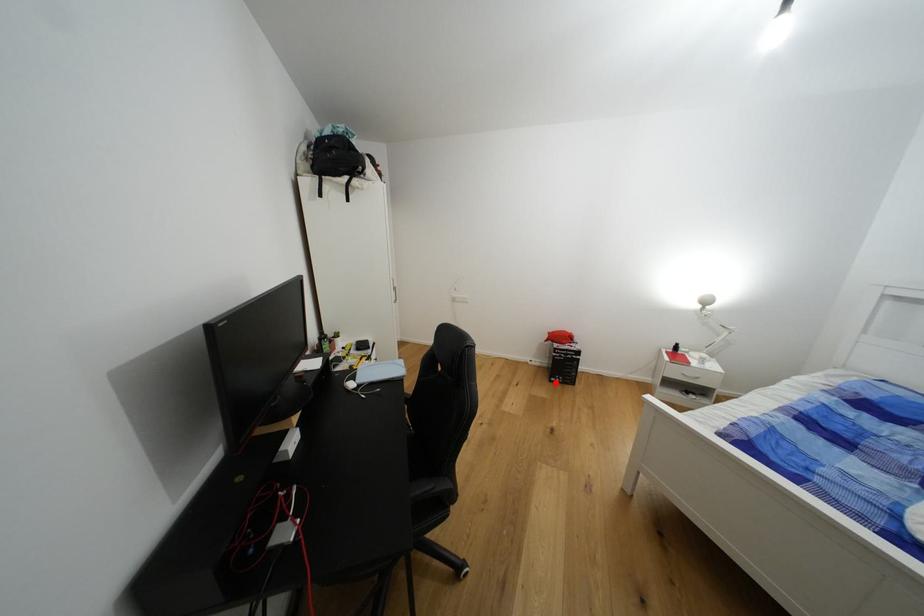
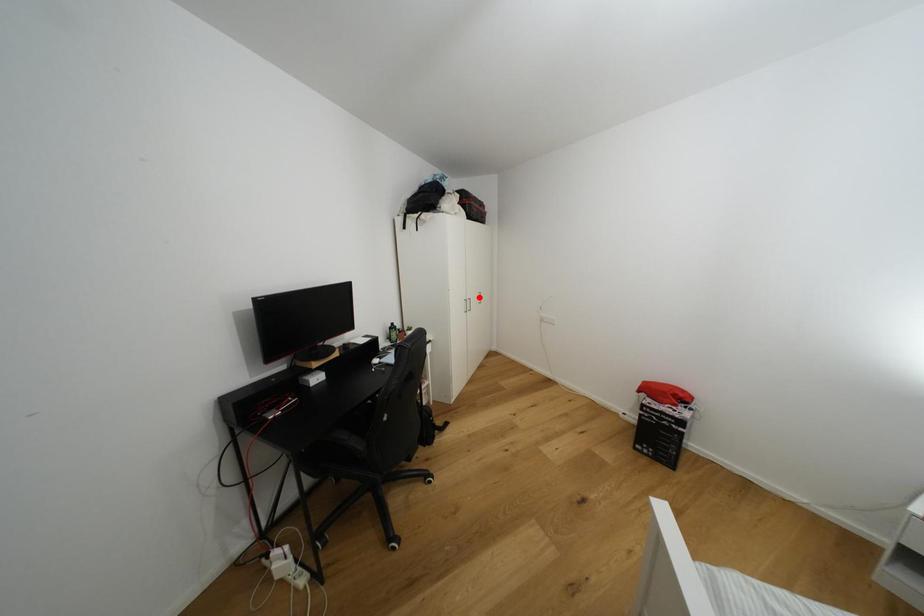
I am providing you with two images of the same scene from different viewpoints. A red point is marked on the first image and another point is marked on the second image. Does the point marked in image1 correspond to the same location as the one in image2?

No